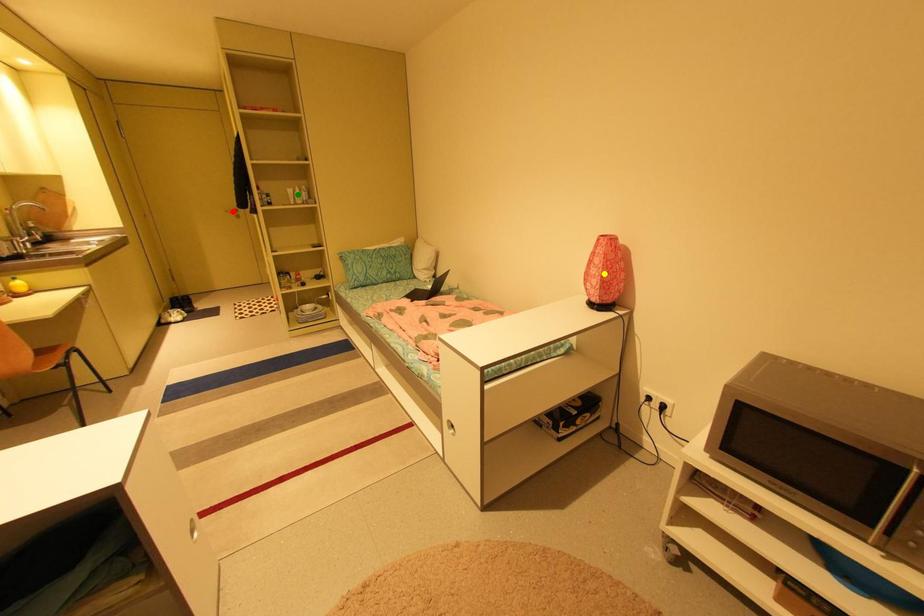
Order these from nearest to farthest:
green point
red point
yellow point

yellow point < green point < red point